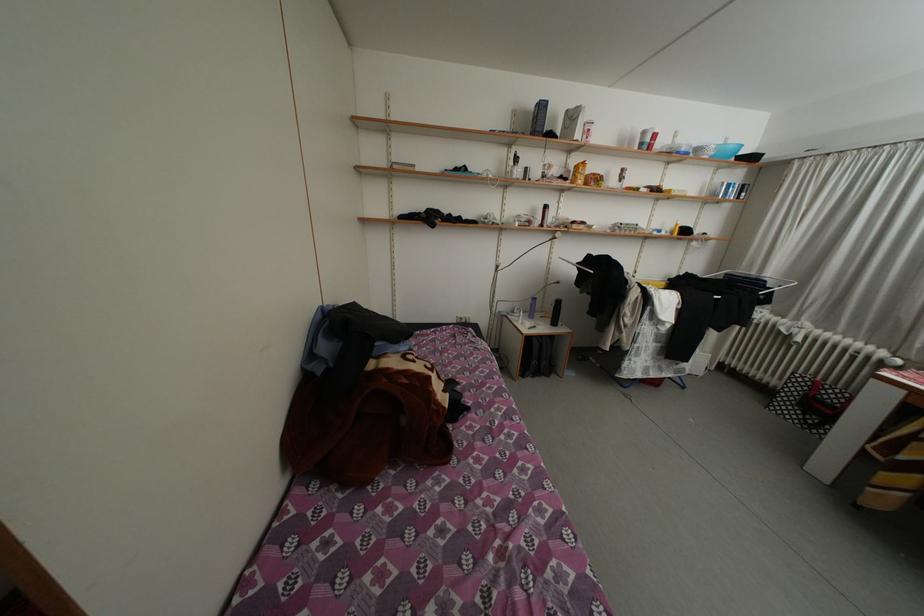
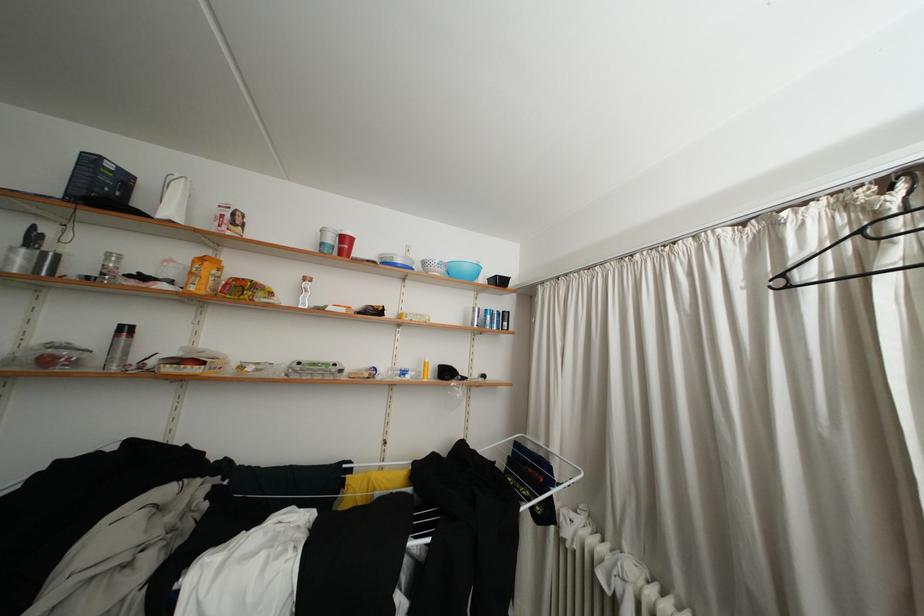
Locate, in the second image, the point that corresponds to (x=519, y=177) in the first image.

(17, 264)